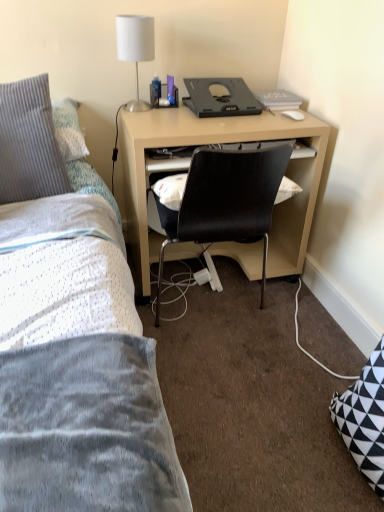
Question: Considering the relative sizes of black plastic desktop at center and gray ribbed pillow at upper left in the image provided, is black plastic desktop at center wider than gray ribbed pillow at upper left?

Choices:
 (A) yes
 (B) no

Answer: (B)

Question: Are black plastic desktop at center and gray ribbed pillow at upper left far apart?

Choices:
 (A) no
 (B) yes

Answer: (A)

Question: Does black plastic desktop at center have a greater height compared to gray ribbed pillow at upper left?

Choices:
 (A) yes
 (B) no

Answer: (B)

Question: Is black plastic desktop at center behind gray ribbed pillow at upper left?

Choices:
 (A) no
 (B) yes

Answer: (B)

Question: From a real-world perspective, does black plastic desktop at center sit lower than gray ribbed pillow at upper left?

Choices:
 (A) no
 (B) yes

Answer: (A)

Question: Considering their positions, is white fabric lampshade at upper center located in front of or behind black plastic desktop at center?

Choices:
 (A) front
 (B) behind

Answer: (A)

Question: From a real-world perspective, relative to black plastic desktop at center, is white fabric lampshade at upper center vertically above or below?

Choices:
 (A) above
 (B) below

Answer: (A)

Question: Looking at the image, does white fabric lampshade at upper center seem bigger or smaller compared to black plastic desktop at center?

Choices:
 (A) big
 (B) small

Answer: (A)

Question: Is white fabric lampshade at upper center wider or thinner than black plastic desktop at center?

Choices:
 (A) thin
 (B) wide

Answer: (A)

Question: In the image, is matte wood computer desk at center positioned in front of or behind black plastic desktop at center?

Choices:
 (A) front
 (B) behind

Answer: (A)

Question: Is matte wood computer desk at center wider or thinner than black plastic desktop at center?

Choices:
 (A) thin
 (B) wide

Answer: (B)

Question: Choose the correct answer: Is matte wood computer desk at center inside black plastic desktop at center or outside it?

Choices:
 (A) inside
 (B) outside

Answer: (B)

Question: In terms of size, does matte wood computer desk at center appear bigger or smaller than black plastic desktop at center?

Choices:
 (A) small
 (B) big

Answer: (B)

Question: From a real-world perspective, is gray ribbed pillow at upper left positioned above or below black plastic desktop at center?

Choices:
 (A) below
 (B) above

Answer: (A)

Question: Looking at their shapes, would you say gray ribbed pillow at upper left is wider or thinner than black plastic desktop at center?

Choices:
 (A) wide
 (B) thin

Answer: (A)